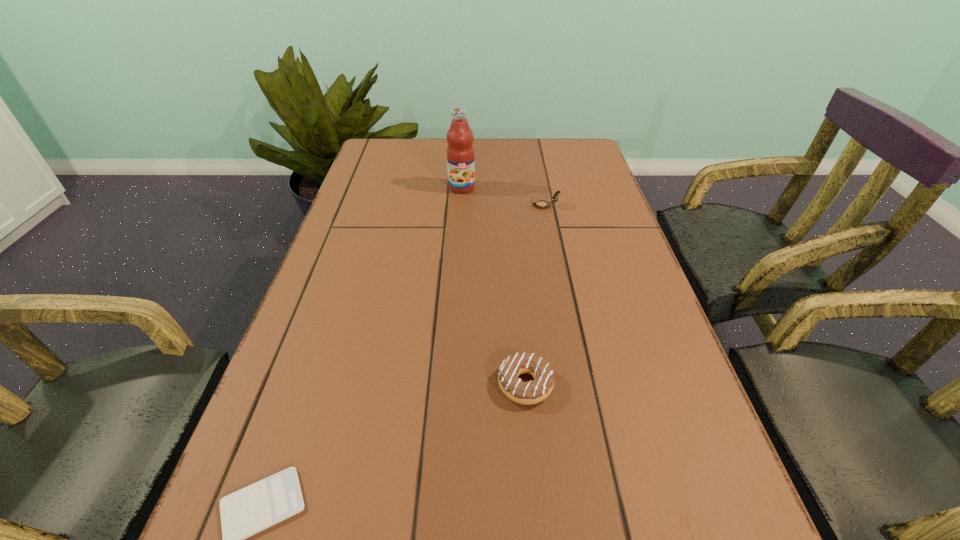
Locate an element on the screen. the farthest object is located at coordinates (460, 153).

Locate an element on the screen. The image size is (960, 540). the tallest object is located at coordinates (460, 153).

I want to click on the second farthest object, so coord(541,204).

I want to click on compass, so click(541, 204).

This screenshot has height=540, width=960. I want to click on the third farthest object, so click(534, 391).

This screenshot has height=540, width=960. I want to click on the second object from right to left, so click(x=534, y=391).

Where is `free space located on the front label of the farthest object`? The image size is (960, 540). free space located on the front label of the farthest object is located at coordinates (457, 273).

I want to click on blank area located on the face of the third nearest object, so click(x=508, y=206).

You are a GUI agent. You are given a task and a screenshot of the screen. Output one action in this format:
    pyautogui.click(x=<x>, y=<y>)
    Task: Click on the blank space located 0.370m on the face of the third nearest object
    Image resolution: width=960 pixels, height=540 pixels.
    Given the screenshot: What is the action you would take?
    pyautogui.click(x=395, y=206)

Locate an element on the screen. Image resolution: width=960 pixels, height=540 pixels. free space located on the face of the third nearest object is located at coordinates (486, 206).